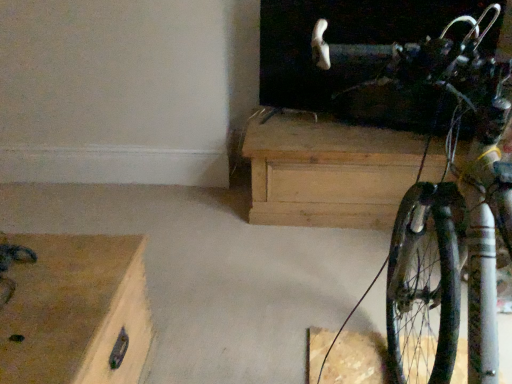
Question: From the image's perspective, is wooden chest at lower left, the 2th chest of drawers viewed from the right, located above or below natural wood chest at center, which is the first chest of drawers in back-to-front order?

Choices:
 (A) above
 (B) below

Answer: (B)

Question: Considering the positions of point (32, 271) and point (293, 135), is point (32, 271) closer or farther from the camera than point (293, 135)?

Choices:
 (A) farther
 (B) closer

Answer: (B)

Question: Estimate the real-world distances between objects in this image. Which object is closer to the natural wood chest at center, positioned as the second chest of drawers in bottom-to-top order?

Choices:
 (A) shiny metallic bicycle at right
 (B) wooden chest at lower left, the 2th chest of drawers viewed from the right

Answer: (A)

Question: Which is nearer to the wooden chest at lower left, which appears as the 2th chest of drawers when viewed from the back?

Choices:
 (A) natural wood chest at center, which is the first chest of drawers in back-to-front order
 (B) shiny metallic bicycle at right

Answer: (B)